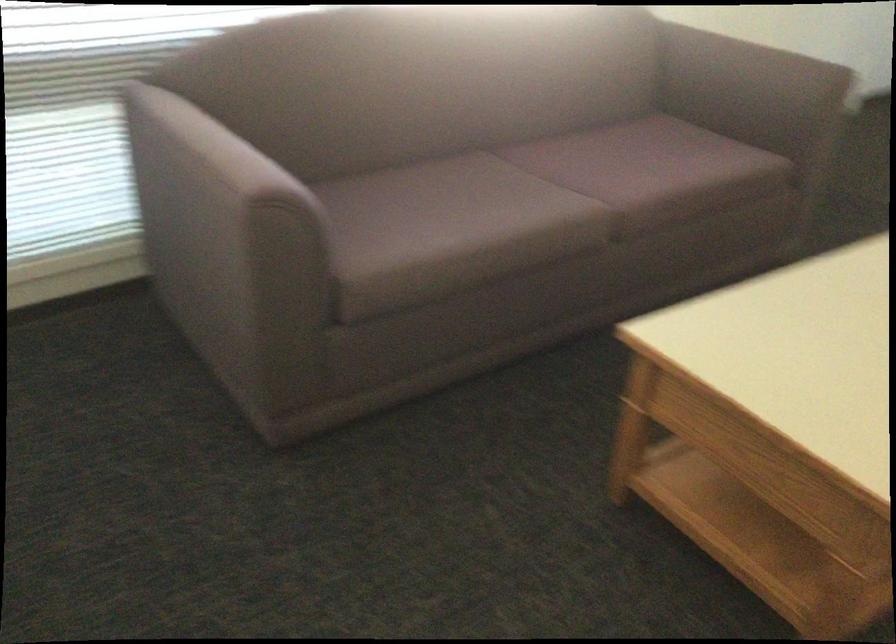
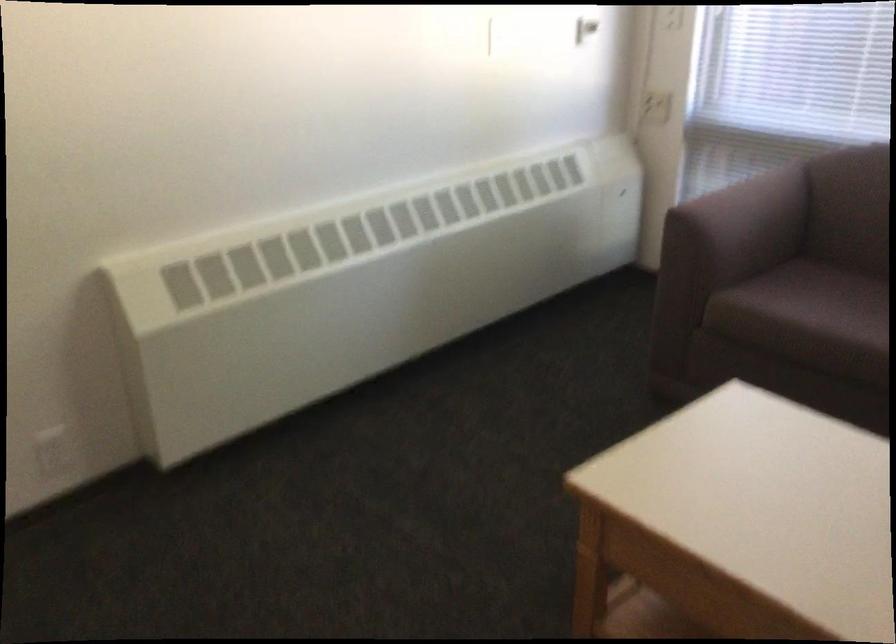
Locate, in the second image, the point that corresponds to (x=398, y=228) in the first image.

(807, 303)